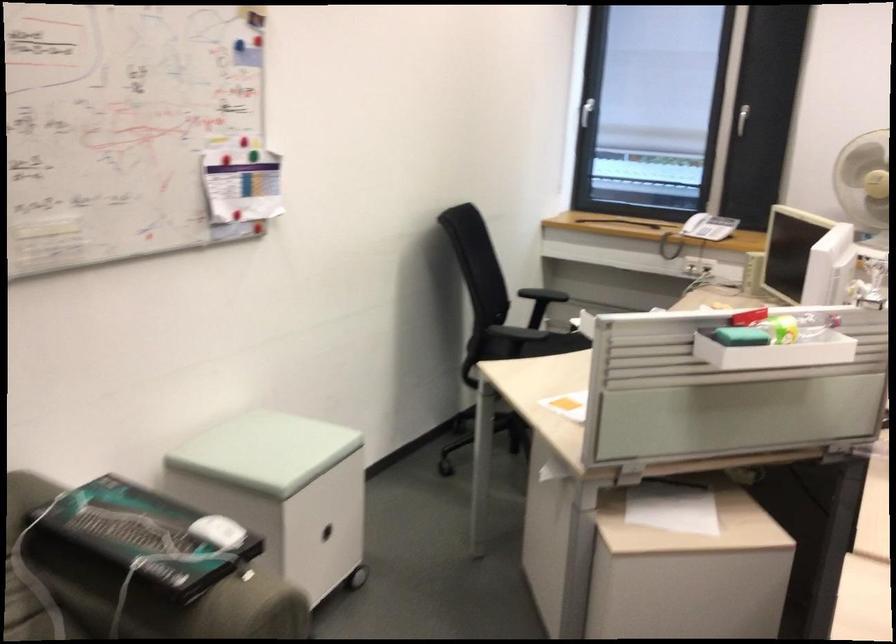
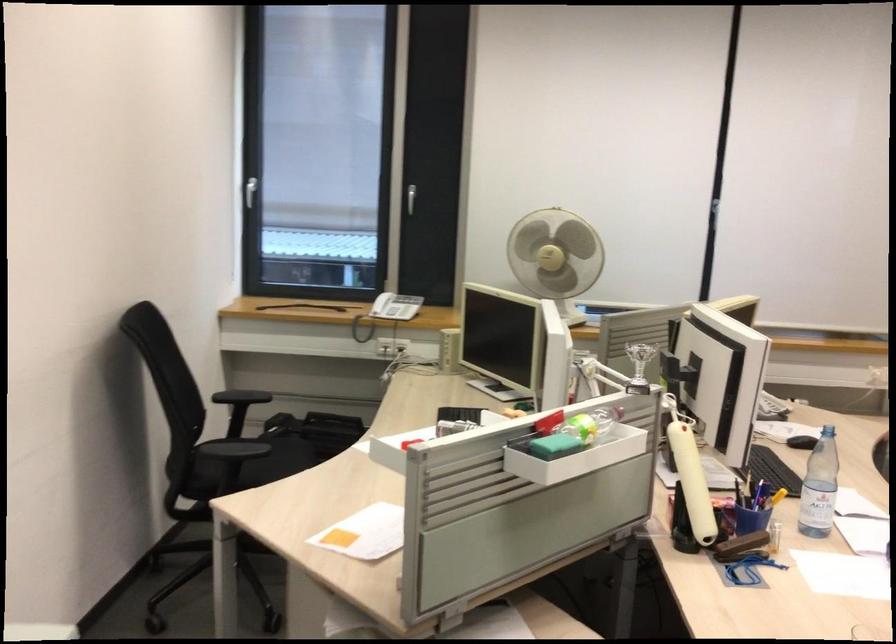
Question: The camera is either moving clockwise (left) or counter-clockwise (right) around the object. The first image is from the beginning of the video and the second image is from the end. Is the camera moving left or right when shooting the video?

Choices:
 (A) Left
 (B) Right

Answer: (A)